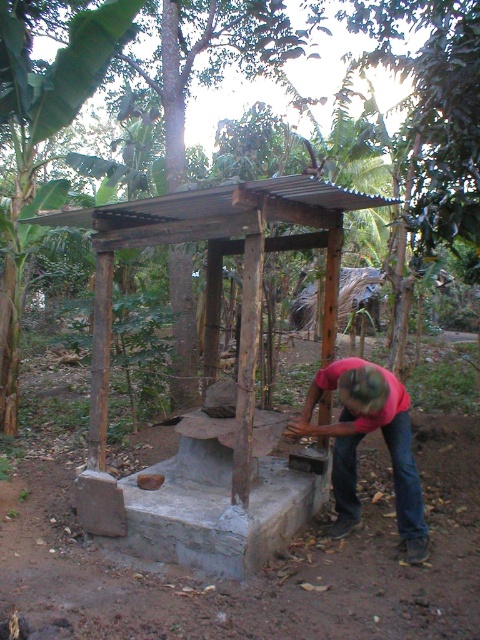
Which of these two, rustic wooden gazebo at center or red fabric shirt at center, stands taller?

With more height is rustic wooden gazebo at center.

Is rustic wooden gazebo at center closer to camera compared to red fabric shirt at center?

That is True.

Who is more forward, (308, 241) or (379, 385)?

Point (379, 385) is more forward.

Where is `rustic wooden gazebo at center`? rustic wooden gazebo at center is located at coordinates (237, 381).